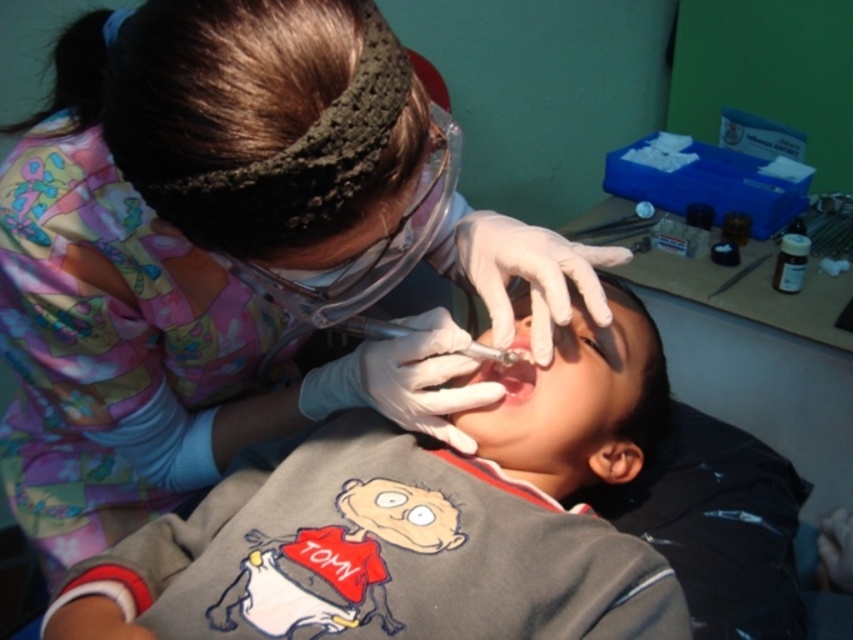
Is point (328, 627) closer to viewer compared to point (386, 333)?

Yes.

From the picture: Can you confirm if gray cotton shirt at center is positioned below metallic needle at center?

Yes.

Identify the location of gray cotton shirt at center. This screenshot has height=640, width=853. pos(415,524).

You are a GUI agent. You are given a task and a screenshot of the screen. Output one action in this format:
    pyautogui.click(x=<x>, y=<y>)
    Task: Click on the gray cotton shirt at center
    
    Given the screenshot: What is the action you would take?
    pyautogui.click(x=415, y=524)

Does point (479, 353) come behind point (524, 323)?

No, it is not.

I want to click on metallic needle at center, so click(372, 326).

Does matte white shirt at center appear over metallic needle at center?

Yes.

The image size is (853, 640). In order to click on matte white shirt at center in this screenshot , I will do `click(227, 252)`.